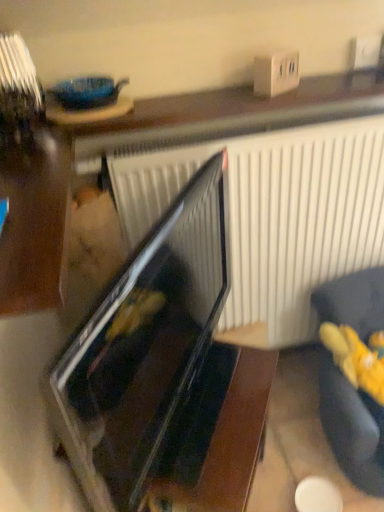
This screenshot has width=384, height=512. In order to click on dark fabric couch at lower right in this screenshot , I will do `click(352, 426)`.

Locate an element on the screen. The width and height of the screenshot is (384, 512). yellow plush toy at lower right is located at coordinates (356, 358).

From the picture: From the image's perspective, is black glossy oven at center positioned above or below dark fabric couch at lower right?

black glossy oven at center is situated higher than dark fabric couch at lower right in the image.

Is black glossy oven at center positioned beyond the bounds of dark fabric couch at lower right?

Yes, black glossy oven at center is located beyond the bounds of dark fabric couch at lower right.

Can you tell me how much black glossy oven at center and dark fabric couch at lower right differ in facing direction?

55.9 degrees.

Is point (134, 292) in front of point (361, 276)?

Yes, it is.

Find the location of `furniture lying below the yellow plush toy at lower right (from the image's perspective)`. furniture lying below the yellow plush toy at lower right (from the image's perspective) is located at coordinates [352, 426].

Between point (357, 343) and point (320, 386), which one is positioned behind?

The point (320, 386) is behind.

Which of these two, yellow plush toy at lower right or dark fabric couch at lower right, stands shorter?

Standing shorter between the two is yellow plush toy at lower right.

Does yellow plush toy at lower right have a smaller size compared to dark fabric couch at lower right?

Yes.

Consider the image. How much distance is there between dark fabric couch at lower right and yellow plush toy at lower right?

dark fabric couch at lower right is 3.83 inches away from yellow plush toy at lower right.

Are dark fabric couch at lower right and yellow plush toy at lower right located far from each other?

Actually, dark fabric couch at lower right and yellow plush toy at lower right are a little close together.

Is dark fabric couch at lower right looking in the opposite direction of yellow plush toy at lower right?

That's right, dark fabric couch at lower right is facing away from yellow plush toy at lower right.

Choose the correct answer: Is dark fabric couch at lower right inside yellow plush toy at lower right or outside it?

dark fabric couch at lower right is not enclosed by yellow plush toy at lower right.

Considering the sizes of yellow plush toy at lower right and black glossy oven at center in the image, is yellow plush toy at lower right wider or thinner than black glossy oven at center?

yellow plush toy at lower right is wider than black glossy oven at center.

Consider the image. From the image's perspective, does yellow plush toy at lower right appear lower than black glossy oven at center?

Yes, from the image's perspective, yellow plush toy at lower right is below black glossy oven at center.

Is yellow plush toy at lower right to the left of black glossy oven at center from the viewer's perspective?

No.

Considering the positions of objects black glossy oven at center and yellow plush toy at lower right in the image provided, who is in front, black glossy oven at center or yellow plush toy at lower right?

black glossy oven at center.

Between black glossy oven at center and yellow plush toy at lower right, which one appears on the left side from the viewer's perspective?

From the viewer's perspective, black glossy oven at center appears more on the left side.

Considering the sizes of objects black glossy oven at center and yellow plush toy at lower right in the image provided, who is taller, black glossy oven at center or yellow plush toy at lower right?

black glossy oven at center is taller.

Is dark fabric couch at lower right outside of black glossy oven at center?

Yes, dark fabric couch at lower right is located beyond the bounds of black glossy oven at center.

In terms of size, does dark fabric couch at lower right appear bigger or smaller than black glossy oven at center?

In the image, dark fabric couch at lower right appears to be larger than black glossy oven at center.

Is black glossy oven at center at the back of dark fabric couch at lower right?

No, black glossy oven at center is not at the back of dark fabric couch at lower right.

The width and height of the screenshot is (384, 512). Find the location of `furniture below the black glossy oven at center (from the image's perspective)`. furniture below the black glossy oven at center (from the image's perspective) is located at coordinates (352, 426).

The height and width of the screenshot is (512, 384). I want to click on oven on the left side of dark fabric couch at lower right, so click(x=143, y=345).

At what (x,y) coordinates should I click in order to perform the action: click on stuff above the dark fabric couch at lower right (from the image's perspective). Please return your answer as a coordinate pair (x, y). Looking at the image, I should click on (356, 358).

Considering their positions, is yellow plush toy at lower right positioned closer to black glossy oven at center than dark fabric couch at lower right?

Based on the image, dark fabric couch at lower right appears to be nearer to black glossy oven at center.

When comparing their distances from dark fabric couch at lower right, does black glossy oven at center or yellow plush toy at lower right seem further?

black glossy oven at center is further to dark fabric couch at lower right.

In the scene shown: Based on their spatial positions, is dark fabric couch at lower right or yellow plush toy at lower right closer to black glossy oven at center?

Among the two, dark fabric couch at lower right is located nearer to black glossy oven at center.

Considering their positions, is dark fabric couch at lower right positioned closer to yellow plush toy at lower right than black glossy oven at center?

dark fabric couch at lower right is closer to yellow plush toy at lower right.

Looking at the image, which one is located further to dark fabric couch at lower right, yellow plush toy at lower right or black glossy oven at center?

black glossy oven at center is positioned further to the anchor dark fabric couch at lower right.

Based on their spatial positions, is black glossy oven at center or dark fabric couch at lower right further from yellow plush toy at lower right?

Based on the image, black glossy oven at center appears to be further to yellow plush toy at lower right.

The height and width of the screenshot is (512, 384). In order to click on furniture between black glossy oven at center and yellow plush toy at lower right from front to back in this screenshot , I will do `click(352, 426)`.